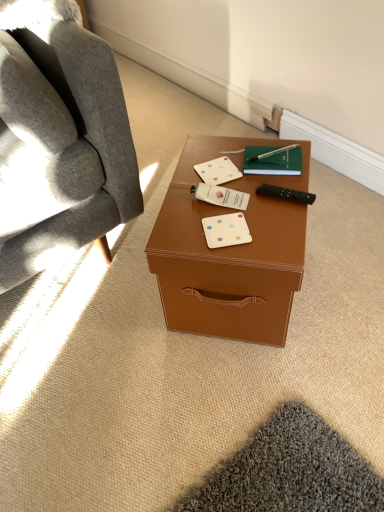
You are a GUI agent. You are given a task and a screenshot of the screen. Output one action in this format:
    pyautogui.click(x=<x>, y=<y>)
    Task: Click on the vacant region in front of white matte business card at center, marked as the 2th business card in a back-to-front arrangement
    
    Given the screenshot: What is the action you would take?
    pyautogui.click(x=234, y=238)